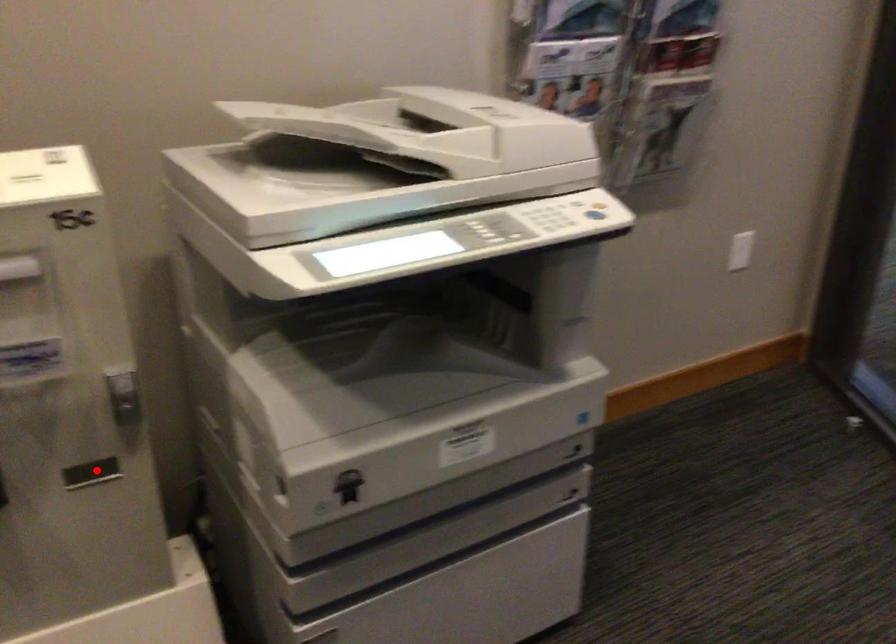
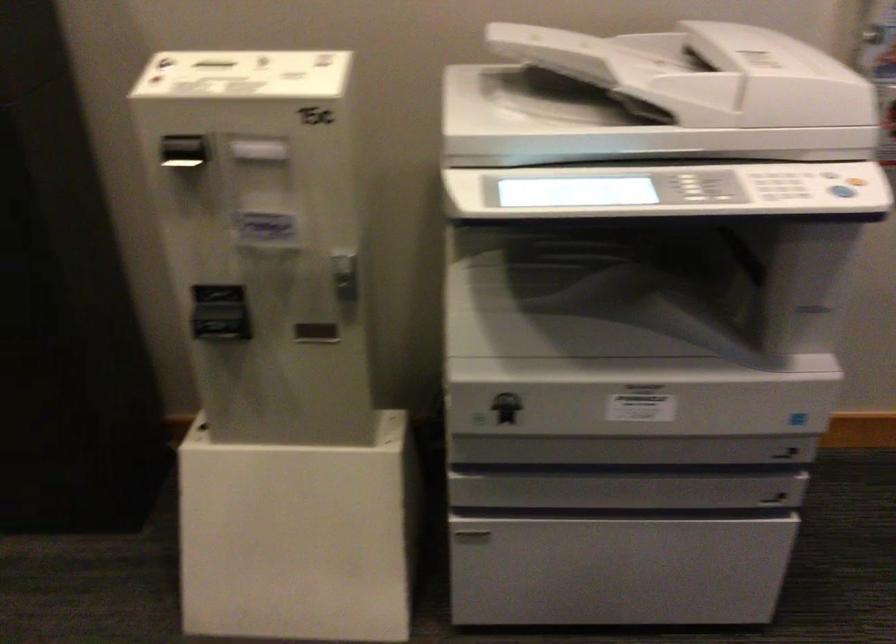
Question: I am providing you with two images of the same scene from different viewpoints. Image1 has a red point marked. In image2, the corresponding 3D location appears at what relative position? Reply with the corresponding letter.

Choices:
 (A) Closer
 (B) Farther

Answer: (B)